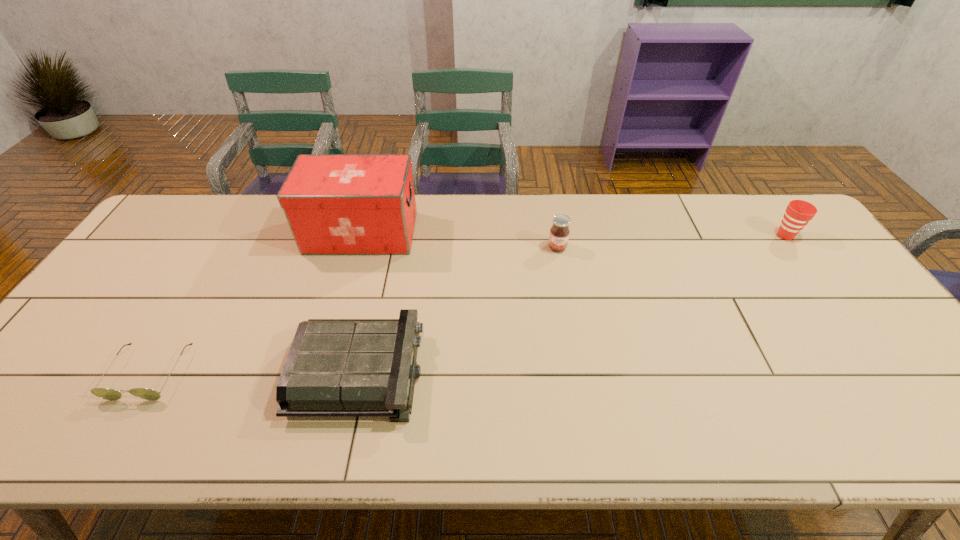
Where is `vacant point located between the rightmost object and the radio receiver`? vacant point located between the rightmost object and the radio receiver is located at coordinates (573, 303).

Image resolution: width=960 pixels, height=540 pixels. Identify the location of free space between the second shortest object and the second object from right to left. (459, 309).

Identify the location of vacant area that lies between the first-aid kit and the second object from right to left. (460, 240).

What are the coordinates of `empty space between the fourth object from left to right and the radio receiver` in the screenshot? It's located at (459, 309).

Where is `free space that is in between the tallest object and the second object from right to left`? The image size is (960, 540). free space that is in between the tallest object and the second object from right to left is located at coordinates (460, 240).

At what (x,y) coordinates should I click in order to perform the action: click on unoccupied position between the tallest object and the fourth object from left to right. Please return your answer as a coordinate pair (x, y). Looking at the image, I should click on (460, 240).

Image resolution: width=960 pixels, height=540 pixels. In order to click on unoccupied position between the sunglasses and the second shortest object in this screenshot , I will do `click(255, 372)`.

Locate an element on the screen. free space that is in between the radio receiver and the first-aid kit is located at coordinates (361, 302).

The height and width of the screenshot is (540, 960). I want to click on vacant area that lies between the rightmost object and the leftmost object, so click(x=468, y=304).

At what (x,y) coordinates should I click in order to perform the action: click on free space between the second object from right to left and the rightmost object. Please return your answer as a coordinate pair (x, y). This screenshot has width=960, height=540. Looking at the image, I should click on (671, 241).